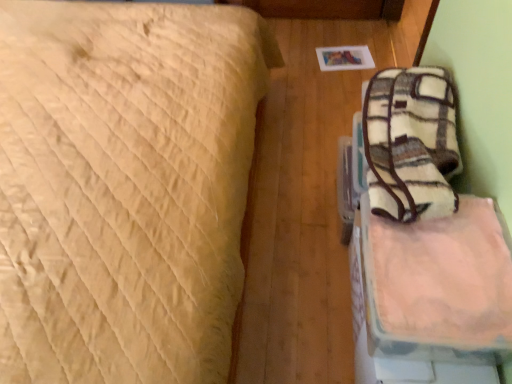
Question: Could you tell me if beige quilted bed at upper left is turned towards pink fabric bag at right?

Choices:
 (A) no
 (B) yes

Answer: (B)

Question: Can you confirm if beige quilted bed at upper left is thinner than pink fabric bag at right?

Choices:
 (A) yes
 (B) no

Answer: (B)

Question: Is beige quilted bed at upper left wider than pink fabric bag at right?

Choices:
 (A) no
 (B) yes

Answer: (B)

Question: Is beige quilted bed at upper left taller than pink fabric bag at right?

Choices:
 (A) yes
 (B) no

Answer: (A)

Question: Is beige quilted bed at upper left touching pink fabric bag at right?

Choices:
 (A) yes
 (B) no

Answer: (B)

Question: Can you confirm if beige quilted bed at upper left is shorter than pink fabric bag at right?

Choices:
 (A) no
 (B) yes

Answer: (A)

Question: Can you confirm if pink fabric bag at right is bigger than beige quilted bed at upper left?

Choices:
 (A) no
 (B) yes

Answer: (A)

Question: Would you say pink fabric bag at right is a long distance from beige quilted bed at upper left?

Choices:
 (A) no
 (B) yes

Answer: (A)

Question: Is pink fabric bag at right shorter than beige quilted bed at upper left?

Choices:
 (A) no
 (B) yes

Answer: (B)

Question: From the image's perspective, is pink fabric bag at right on top of beige quilted bed at upper left?

Choices:
 (A) yes
 (B) no

Answer: (B)

Question: Can you confirm if pink fabric bag at right is positioned to the left of beige quilted bed at upper left?

Choices:
 (A) yes
 (B) no

Answer: (B)

Question: From the image's perspective, would you say pink fabric bag at right is shown under beige quilted bed at upper left?

Choices:
 (A) no
 (B) yes

Answer: (B)

Question: Considering the positions of point (10, 258) and point (385, 274), is point (10, 258) closer or farther from the camera than point (385, 274)?

Choices:
 (A) farther
 (B) closer

Answer: (B)